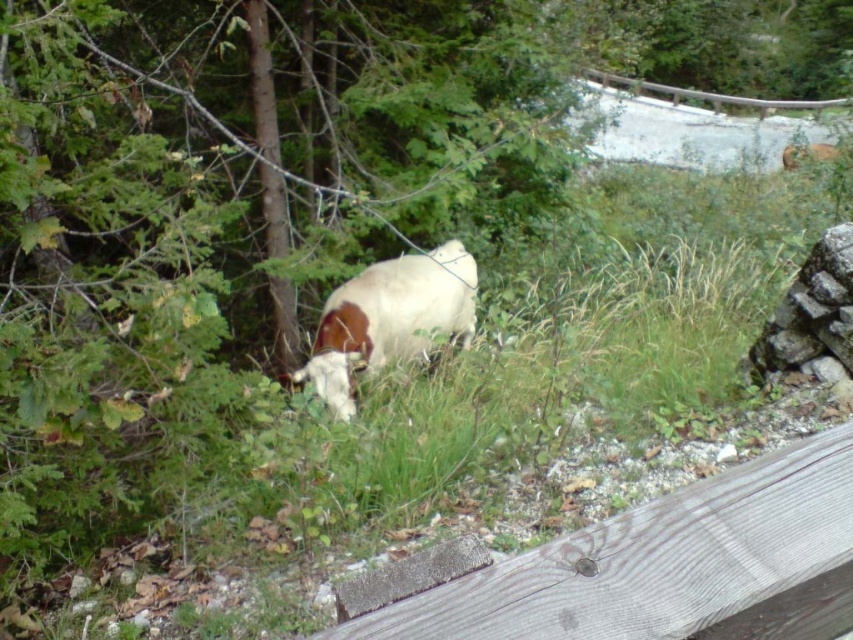
You are a farmer checking your property. You see the gray wood fence at lower right and the white woolen goat at upper right. Which object is taller?

The white woolen goat at upper right is taller than the gray wood fence at lower right.

You are standing in the rural scene looking at the cow and the point at coordinates (486, 556). Which object is closer to you?

The point at coordinates (486, 556) is closer to you than the cow because it is only 3.55 feet away from the viewer, while the cow is farther away.